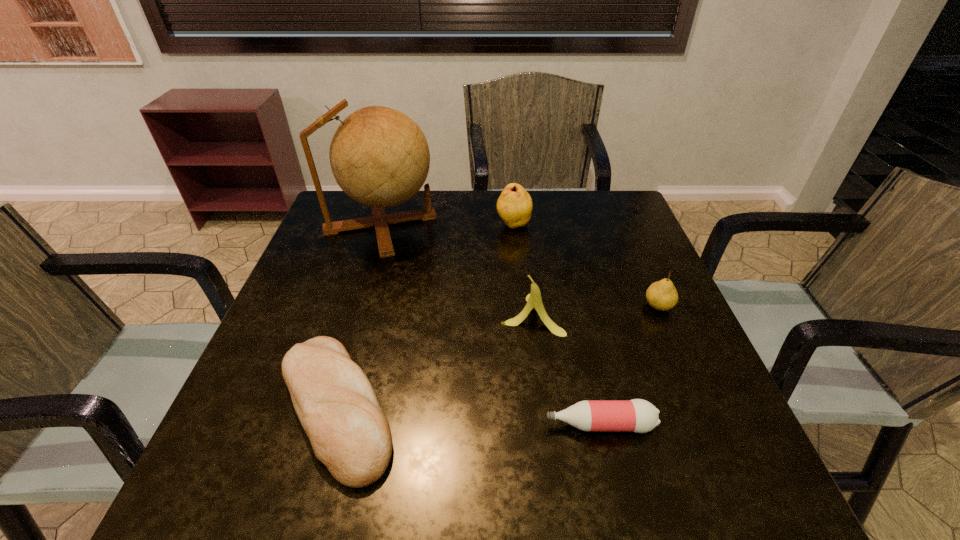
The height and width of the screenshot is (540, 960). I want to click on the tallest object, so (x=379, y=156).

At what (x,y) coordinates should I click in order to perform the action: click on the taller pear. Please return your answer as a coordinate pair (x, y). Looking at the image, I should click on (514, 206).

Image resolution: width=960 pixels, height=540 pixels. What are the coordinates of `the left pear` in the screenshot? It's located at (514, 206).

Locate an element on the screen. banana is located at coordinates (534, 300).

Image resolution: width=960 pixels, height=540 pixels. I want to click on the fourth tallest object, so click(x=662, y=295).

Where is `the shorter pear`? Image resolution: width=960 pixels, height=540 pixels. the shorter pear is located at coordinates (662, 295).

The height and width of the screenshot is (540, 960). Identify the location of bread. (335, 402).

What are the coordinates of `bottle` in the screenshot? It's located at (x=637, y=415).

You are a GUI agent. You are given a task and a screenshot of the screen. Output one action in this format:
    pyautogui.click(x=<x>, y=<y>)
    Task: Click on the vacant region located 0.380m on the surface of the tallest object
    
    Given the screenshot: What is the action you would take?
    pyautogui.click(x=574, y=224)

I want to click on vacant space located 0.290m on the right of the farther pear, so click(x=636, y=225).